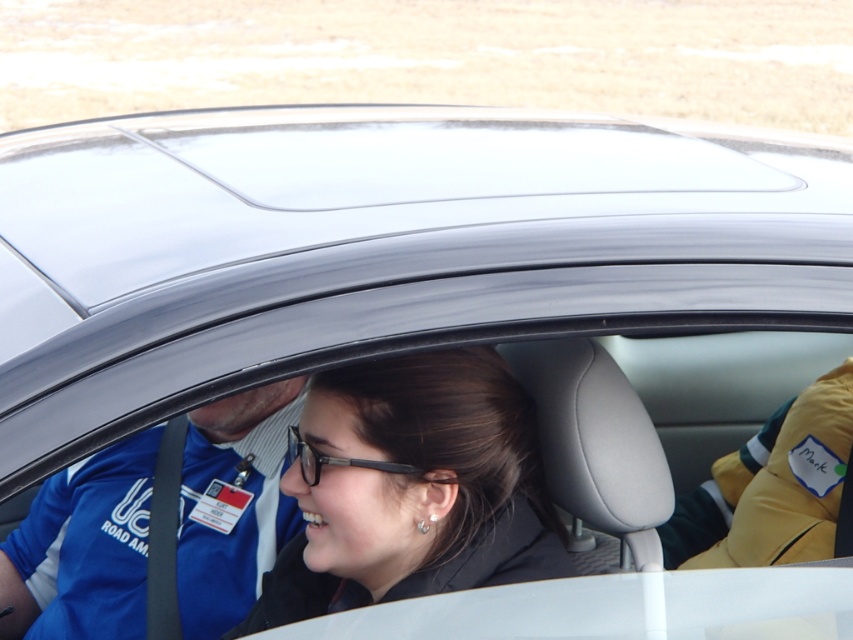
Looking at this image, you are standing outside the car looking through the windshield. Where is the blue fabric shirt at left located?

The blue fabric shirt at left is located at point (83, 548).

You are a passenger in the car and want to adjust the AC vent located above the black plastic glasses at center. Can you reach it without moving the matte black hair at center?

The matte black hair at center is taller than black plastic glasses at center, so it might block access to the AC vent above the glasses. Moving the hair could be necessary for reaching the vent.